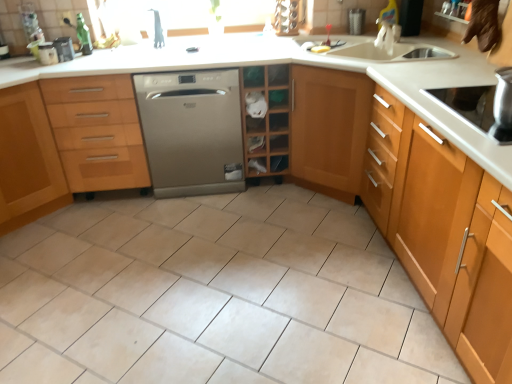
Question: Which is correct: black plastic container at upper left is inside stainless steel cooktop at right, or outside of it?

Choices:
 (A) inside
 (B) outside

Answer: (B)

Question: In terms of height, does black plastic container at upper left look taller or shorter compared to stainless steel cooktop at right?

Choices:
 (A) tall
 (B) short

Answer: (A)

Question: Which object is positioned farthest from the black plastic container at upper left?

Choices:
 (A) light brown wood cabinet at right, marked as the 1th cabinetry in a right-to-left arrangement
 (B) stainless steel cooktop at right
 (C) light brown wood cabinet at left, marked as the third cabinetry in a right-to-left arrangement
 (D) wooden cabinet at left, marked as the second cabinetry in a left-to-right arrangement
 (E) satin silver dishwasher at center

Answer: (B)

Question: Estimate the real-world distances between objects in this image. Which object is closer to the wooden shelf at center?

Choices:
 (A) wooden cabinet at left, marked as the 2th cabinetry in a right-to-left arrangement
 (B) light brown wood cabinet at right, marked as the 1th cabinetry in a right-to-left arrangement
 (C) black plastic container at upper left
 (D) stainless steel cooktop at right
 (E) satin silver dishwasher at center

Answer: (E)